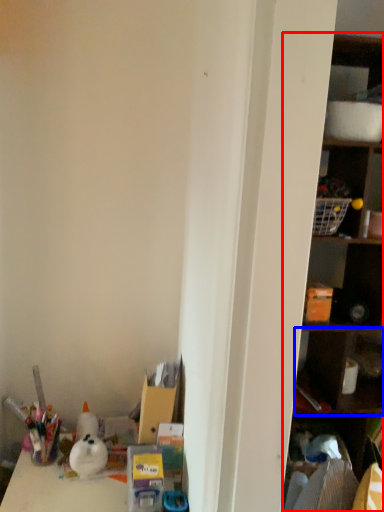
Question: Which object appears farthest to the camera in this image, shelf (highlighted by a red box) or cabinet (highlighted by a blue box)?

Choices:
 (A) shelf
 (B) cabinet

Answer: (B)